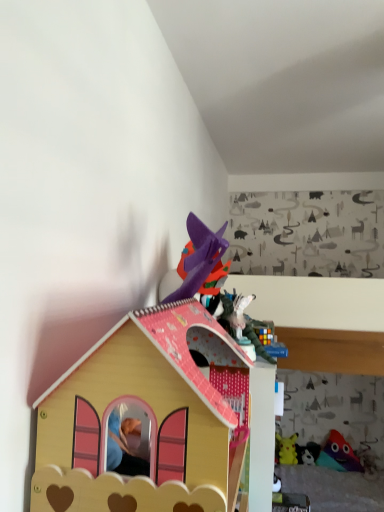
Question: From a real-world perspective, is yellow plush toy at upper right, placed as the 3th toy when sorted from top to bottom, physically above rubber duck at lower right, the fourth toy in the back-to-front sequence?

Choices:
 (A) no
 (B) yes

Answer: (B)

Question: Is yellow plush toy at upper right, marked as the 5th toy in a front-to-back arrangement, far from rubber duck at lower right, the 5th toy positioned from the left?

Choices:
 (A) yes
 (B) no

Answer: (B)

Question: From the image's perspective, does yellow plush toy at upper right, placed as the 3th toy when sorted from top to bottom, appear higher than rubber duck at lower right, the 5th toy positioned from the left?

Choices:
 (A) no
 (B) yes

Answer: (B)

Question: Considering the relative sizes of yellow plush toy at upper right, marked as the 5th toy in a front-to-back arrangement, and rubber duck at lower right, the 5th toy positioned from the left, in the image provided, is yellow plush toy at upper right, marked as the 5th toy in a front-to-back arrangement, shorter than rubber duck at lower right, the 5th toy positioned from the left,?

Choices:
 (A) yes
 (B) no

Answer: (B)

Question: Considering the relative sizes of yellow plush toy at upper right, marked as the 1th toy in a back-to-front arrangement, and rubber duck at lower right, the 1th toy positioned from the bottom, in the image provided, is yellow plush toy at upper right, marked as the 1th toy in a back-to-front arrangement, smaller than rubber duck at lower right, the 1th toy positioned from the bottom,?

Choices:
 (A) yes
 (B) no

Answer: (A)

Question: Is wooden dollhouse at center, the fifth toy from the bottom, wider or thinner than multicolored plush toy at lower right, the 4th toy positioned from the left?

Choices:
 (A) thin
 (B) wide

Answer: (B)

Question: From a real-world perspective, relative to multicolored plush toy at lower right, positioned as the third toy in back-to-front order, is wooden dollhouse at center, the fifth toy from the bottom, vertically above or below?

Choices:
 (A) above
 (B) below

Answer: (A)

Question: Considering the positions of wooden dollhouse at center, arranged as the 5th toy when viewed from the right, and multicolored plush toy at lower right, the 4th toy positioned from the left, in the image, is wooden dollhouse at center, arranged as the 5th toy when viewed from the right, bigger or smaller than multicolored plush toy at lower right, the 4th toy positioned from the left,?

Choices:
 (A) big
 (B) small

Answer: (A)

Question: Is point (46, 425) closer or farther from the camera than point (339, 439)?

Choices:
 (A) farther
 (B) closer

Answer: (B)

Question: In terms of width, does rubber duck at lower right, the fourth toy in the back-to-front sequence, look wider or thinner when compared to yellow plush toy at upper right, marked as the 4th toy in a right-to-left arrangement?

Choices:
 (A) thin
 (B) wide

Answer: (B)

Question: Considering their positions, is rubber duck at lower right, the 5th toy positioned from the left, located in front of or behind yellow plush toy at upper right, which ranks as the second toy in left-to-right order?

Choices:
 (A) behind
 (B) front

Answer: (B)

Question: From a real-world perspective, is rubber duck at lower right, the first toy when ordered from right to left, above or below yellow plush toy at upper right, marked as the 5th toy in a front-to-back arrangement?

Choices:
 (A) below
 (B) above

Answer: (A)

Question: Would you say rubber duck at lower right, marked as the 5th toy in a top-to-bottom arrangement, is inside or outside yellow plush toy at upper right, marked as the 5th toy in a front-to-back arrangement?

Choices:
 (A) inside
 (B) outside

Answer: (B)

Question: Is multicolored plush toy at lower right, positioned as the 4th toy in bottom-to-top order, inside the boundaries of yellow plush toy at upper right, which ranks as the second toy in left-to-right order, or outside?

Choices:
 (A) inside
 (B) outside

Answer: (B)

Question: Is point (357, 467) closer or farther from the camera than point (278, 439)?

Choices:
 (A) farther
 (B) closer

Answer: (B)